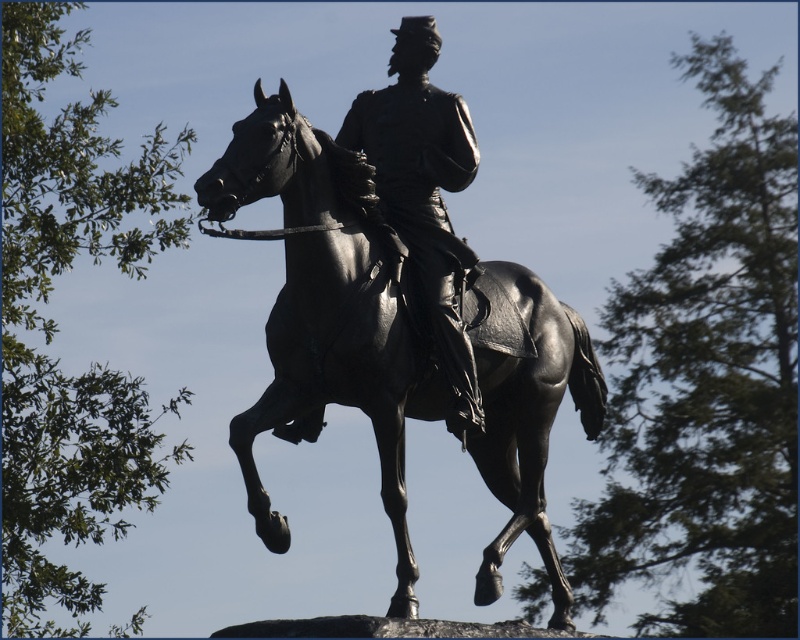
You are a tour guide leading a group near the statue. A visitor asks if they can touch the polished bronze horse at center and the polished bronze statue at center. Considering the safety guidelines that prohibit touching artworks within 3 meters, can they safely touch both without violating the rules?

The distance between the polished bronze horse at center and the polished bronze statue at center is 3.62 meters. Since the safety guidelines prohibit touching artworks within 3 meters, the visitor can safely touch both as they are more than 3 meters apart.

Based on the scene description, which object is taller between the polished bronze horse at center and the polished bronze statue at center?

The polished bronze horse at center is taller than the polished bronze statue at center according to the description.